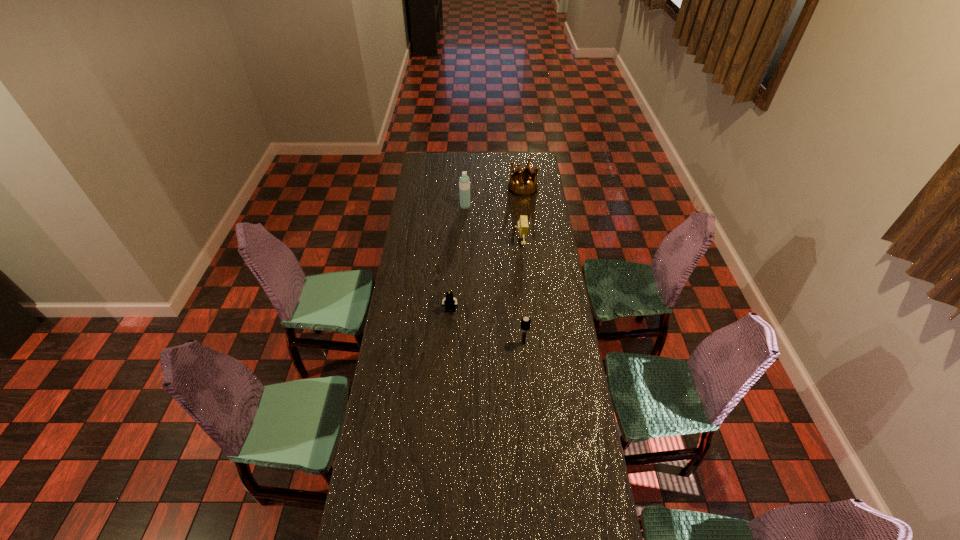
What are the coordinates of `free space at the far right corner of the desktop` in the screenshot? It's located at (529, 152).

Identify the location of unoccupied area between the sponge and the fourth farthest object. (485, 277).

Identify the location of free space between the farthest object and the nearest object. The image size is (960, 540). (523, 266).

Locate an element on the screen. The image size is (960, 540). free point between the nearest object and the crown is located at coordinates (523, 266).

Where is `vacant region between the shortest object and the water bottle`? The height and width of the screenshot is (540, 960). vacant region between the shortest object and the water bottle is located at coordinates (458, 259).

Where is `vacant area between the water bottle and the hairbrush`? vacant area between the water bottle and the hairbrush is located at coordinates (494, 274).

Where is `free space between the farthest object and the hairbrush`? This screenshot has width=960, height=540. free space between the farthest object and the hairbrush is located at coordinates (523, 266).

This screenshot has height=540, width=960. Identify the location of vacant space that is in between the farthest object and the fourth farthest object. (487, 249).

Locate which object is the second closest to the hairbrush. Please provide its 2D coordinates. Your answer should be formatted as a tuple, i.e. [(x, y)], where the tuple contains the x and y coordinates of a point satisfying the conditions above.

[(523, 226)]

Locate which object ranks third in proximity to the Lego. Please provide its 2D coordinates. Your answer should be formatted as a tuple, i.e. [(x, y)], where the tuple contains the x and y coordinates of a point satisfying the conditions above.

[(464, 182)]